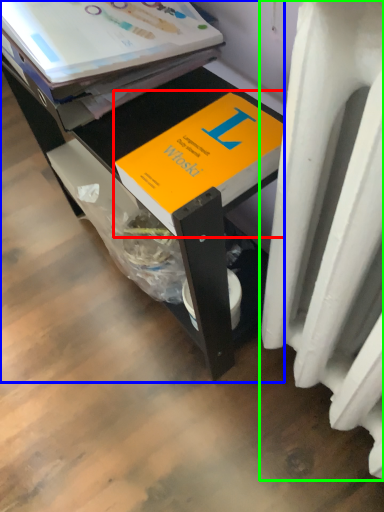
Question: Estimate the real-world distances between objects in this image. Which object is farther from book (highlighted by a red box), desk (highlighted by a blue box) or heater (highlighted by a green box)?

Choices:
 (A) desk
 (B) heater

Answer: (B)